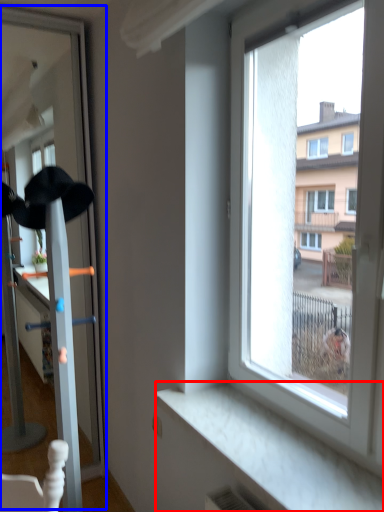
Question: Which object is closer to the camera taking this photo, window sill (highlighted by a red box) or screen door (highlighted by a blue box)?

Choices:
 (A) window sill
 (B) screen door

Answer: (A)